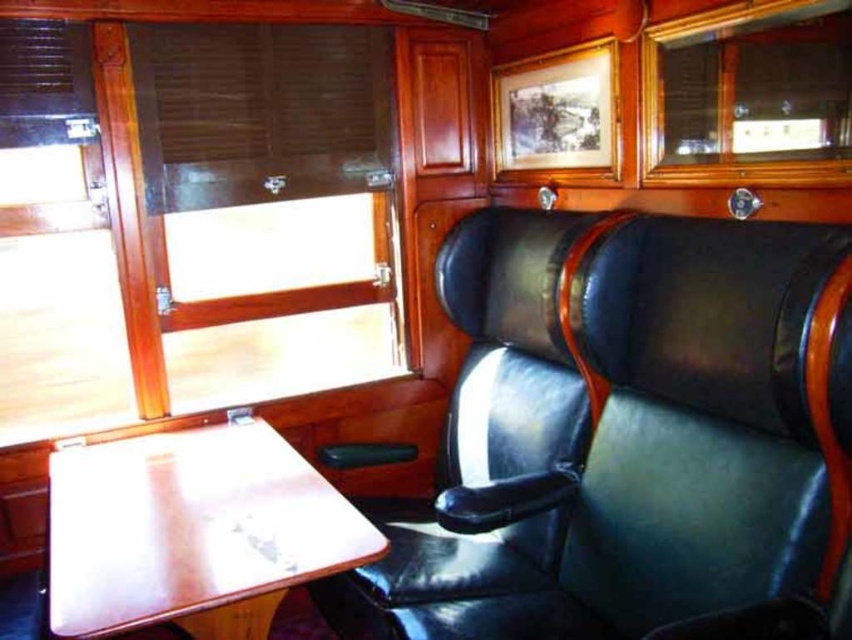
Question: Can you confirm if wooden panel at upper left is wider than wooden table at lower left?

Choices:
 (A) yes
 (B) no

Answer: (B)

Question: Does black leather chair at center appear on the left side of wooden table at lower left?

Choices:
 (A) no
 (B) yes

Answer: (A)

Question: Which object is the farthest from the wooden table at lower left?

Choices:
 (A) wooden panel at upper left
 (B) black leather chair at center

Answer: (A)

Question: Can you confirm if wooden panel at upper left is positioned above black leather chair at center?

Choices:
 (A) no
 (B) yes

Answer: (B)

Question: Considering the real-world distances, which object is closest to the wooden panel at upper left?

Choices:
 (A) wooden frame picture at upper center
 (B) wooden table at lower left

Answer: (B)

Question: Which of the following is the closest to the observer?

Choices:
 (A) (288, 28)
 (B) (701, 20)

Answer: (B)